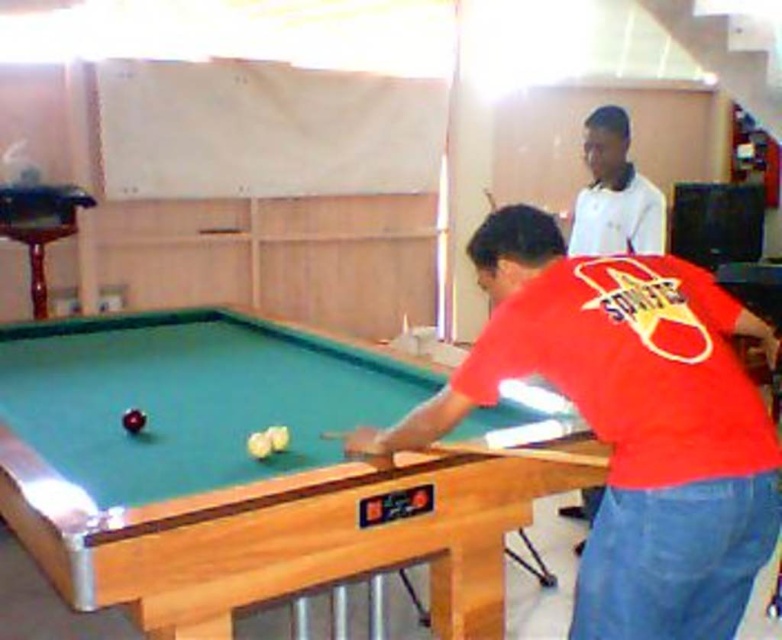
You are a game referee standing at the edge of the pool table. You need to ensure that the distance between the red matte shirt at center and the wooden smooth cue at center is at least 14 inches to avoid interference. Is the current distance compliant with the rule?

The red matte shirt at center is only 12.30 inches from the wooden smooth cue at center, which is less than the required 14 inches. Therefore, the current distance does not comply with the rule and needs adjustment.

You are a photographer trying to capture a candid shot of both the red matte shirt at center and the white smooth shirt at upper center. Based on their positions, which shirt should you focus on first to ensure both are in frame?

The red matte shirt at center is wider than the white smooth shirt at upper center, so you should focus on the red matte shirt at center first to ensure both are in frame.

You are a photographer in the room and want to take a photo of both the red matte shirt at center and the white smooth shirt at upper center. Can you capture both in a single shot without moving the camera?

The red matte shirt at center is positioned under the white smooth shirt at upper center, so yes, both can be captured in a single photo without moving the camera as they are aligned vertically.